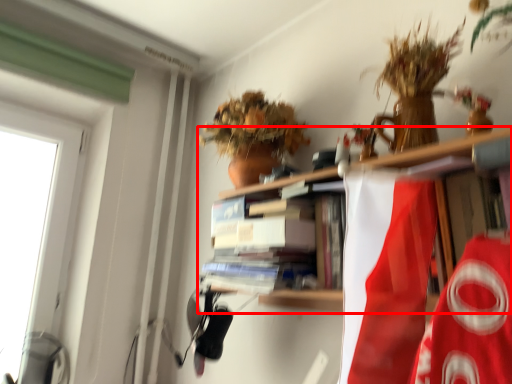
Question: From the image's perspective, where is shelf (annotated by the red box) located relative to book?

Choices:
 (A) above
 (B) below

Answer: (B)